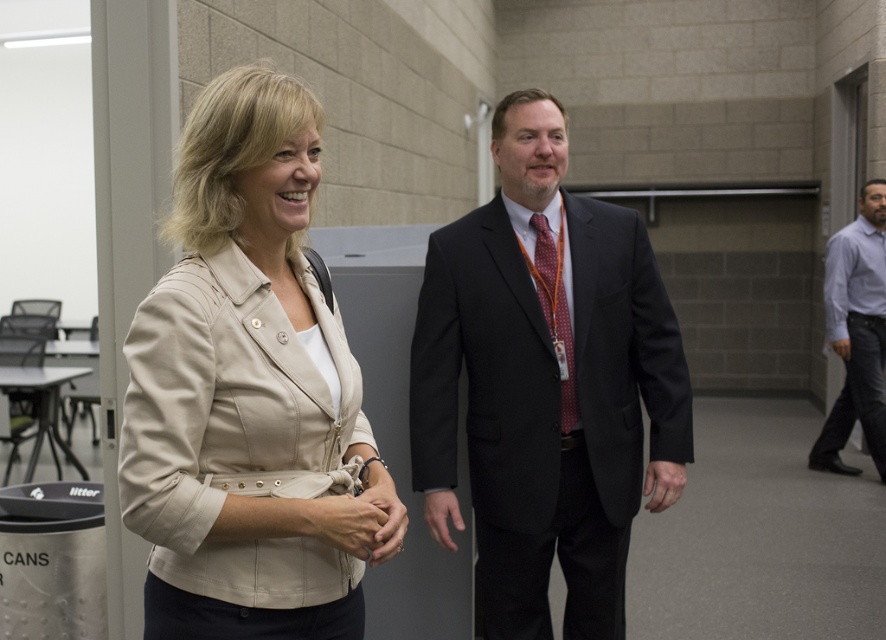
Question: Does dark suit at center appear on the left side of polka dot silk tie at center?

Choices:
 (A) yes
 (B) no

Answer: (A)

Question: Can you confirm if dark suit at center is positioned below polka dot silk tie at center?

Choices:
 (A) no
 (B) yes

Answer: (B)

Question: Which of the following is the closest to the observer?

Choices:
 (A) (869, 244)
 (B) (245, 310)
 (C) (566, 420)

Answer: (B)

Question: Considering the real-world distances, which object is closest to the polka dot silk tie at center?

Choices:
 (A) light blue shirt at right
 (B) dark suit at center
 (C) beige fabric jacket at center

Answer: (B)

Question: Estimate the real-world distances between objects in this image. Which object is farther from the polka dot silk tie at center?

Choices:
 (A) beige fabric jacket at center
 (B) dark suit at center
 (C) light blue shirt at right

Answer: (C)

Question: Is beige fabric jacket at center wider than polka dot silk tie at center?

Choices:
 (A) yes
 (B) no

Answer: (A)